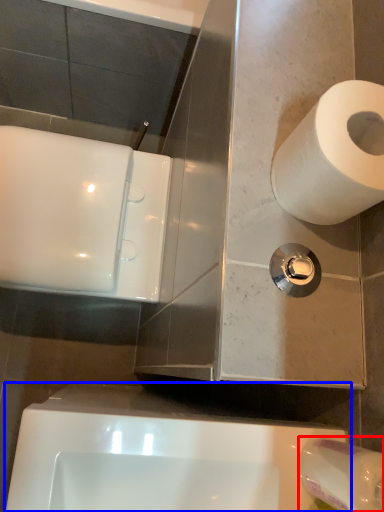
Question: Among these objects, which one is nearest to the camera, toilet paper (highlighted by a red box) or bath (highlighted by a blue box)?

Choices:
 (A) toilet paper
 (B) bath

Answer: (A)